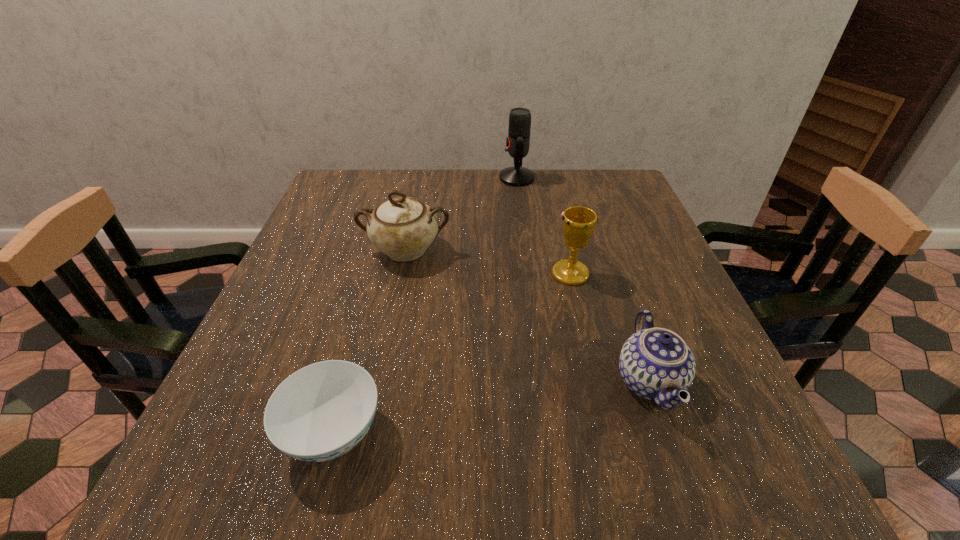
At what (x,y) coordinates should I click in order to perform the action: click on microphone. Please return your answer as a coordinate pair (x, y). This screenshot has width=960, height=540. Looking at the image, I should click on (518, 140).

Where is `the farthest object`? the farthest object is located at coordinates coord(518,140).

Find the location of a particular element. The width and height of the screenshot is (960, 540). the tallest chinaware is located at coordinates (403, 227).

Find the location of a particular element. The image size is (960, 540). chalice is located at coordinates (578, 223).

Identify the location of the second shortest chinaware. The height and width of the screenshot is (540, 960). (655, 363).

This screenshot has width=960, height=540. What are the coordinates of `the fourth tallest object` in the screenshot? It's located at (655, 363).

At what (x,y) coordinates should I click in order to perform the action: click on the shortest object. Please return your answer as a coordinate pair (x, y). The height and width of the screenshot is (540, 960). Looking at the image, I should click on (322, 411).

Locate an element on the screen. Image resolution: width=960 pixels, height=540 pixels. free space located on the side of the tallest object with the red ring is located at coordinates (416, 178).

Find the location of a particular element. Image resolution: width=960 pixels, height=540 pixels. vacant area situated 0.350m on the side of the tallest object with the red ring is located at coordinates (382, 178).

Find the location of a particular element. This screenshot has height=540, width=960. blank space located on the side of the tallest object with the red ring is located at coordinates (396, 178).